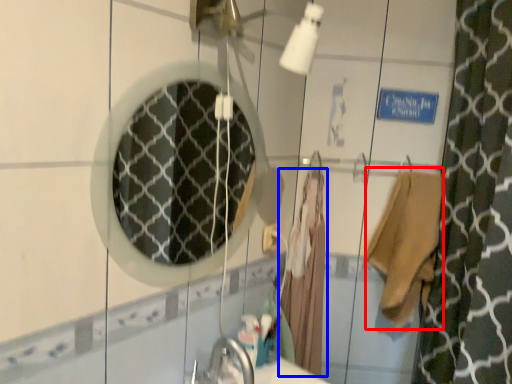
Question: Among these objects, which one is nearest to the camera, robe (highlighted by a red box) or bathrobe (highlighted by a blue box)?

Choices:
 (A) robe
 (B) bathrobe

Answer: (A)